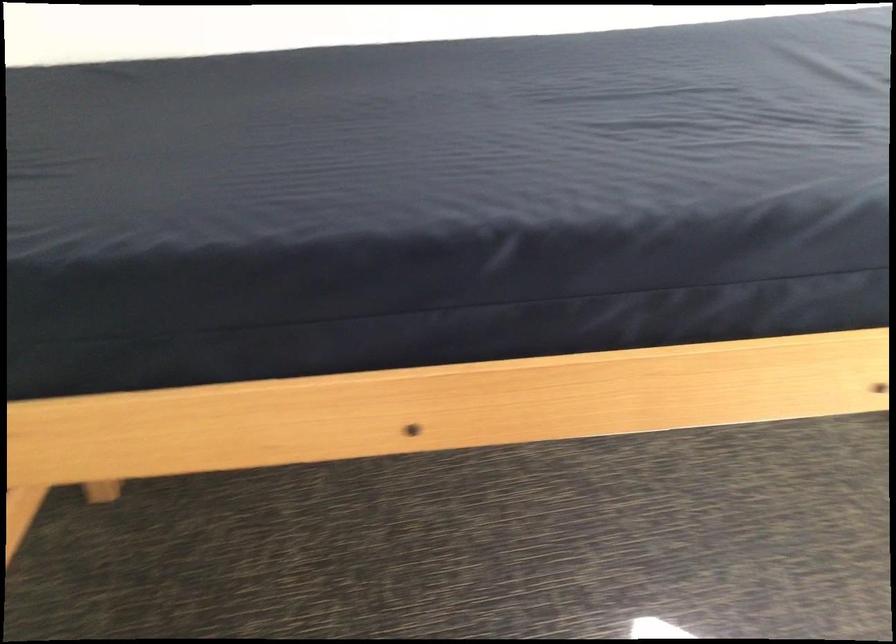
What do you see at coordinates (165, 436) in the screenshot? I see `the wooden bed rail` at bounding box center [165, 436].